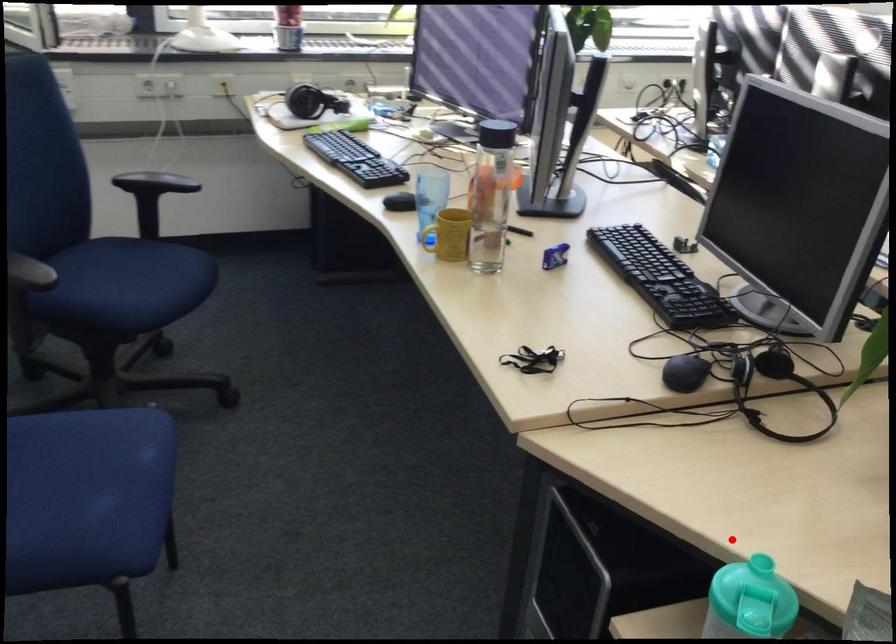
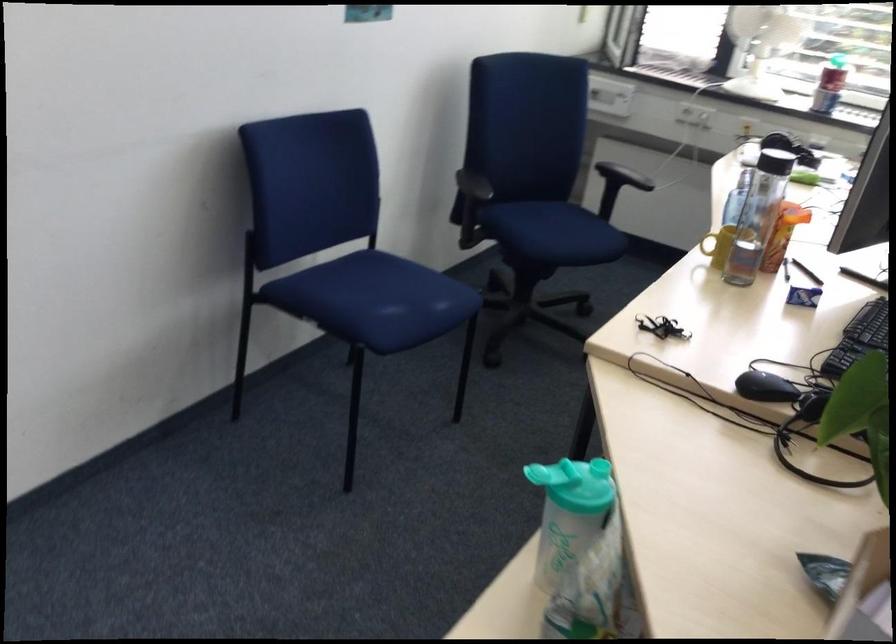
In the second image, find the point that corresponds to the highlighted location in the first image.

(599, 468)